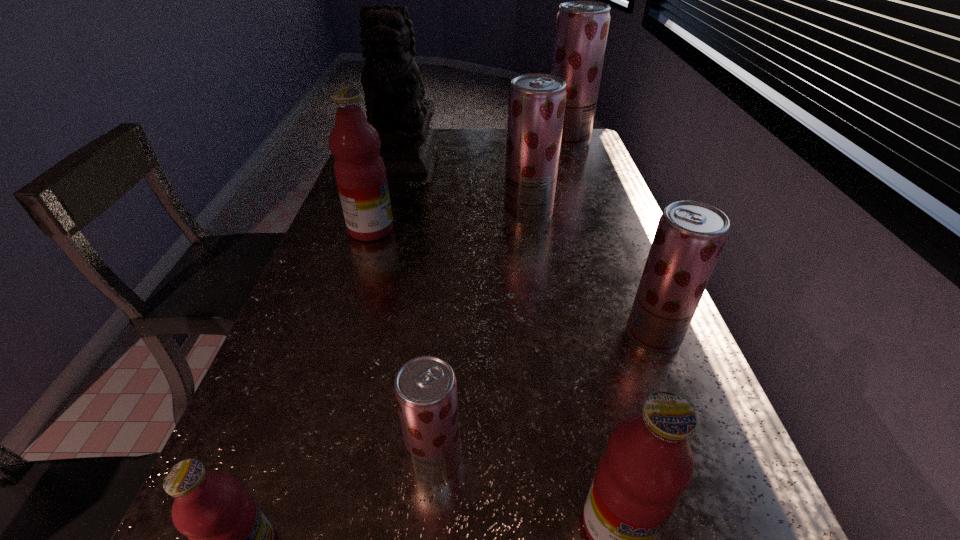
Select which object appears as the fourth closest to the third fruit juice from left to right. Please provide its 2D coordinates. Your answer should be formatted as a tuple, i.e. [(x, y)], where the tuple contains the x and y coordinates of a point satisfying the conditions above.

[(360, 173)]

You are a GUI agent. You are given a task and a screenshot of the screen. Output one action in this format:
    pyautogui.click(x=<x>, y=<y>)
    Task: Click on the fourth closest object relative to the third strawberry fruit juice from right to left
    
    Given the screenshot: What is the action you would take?
    pyautogui.click(x=690, y=235)

Identify which fruit juice is located as the nearest to the second farthest strawberry fruit juice. Please provide its 2D coordinates. Your answer should be formatted as a tuple, i.e. [(x, y)], where the tuple contains the x and y coordinates of a point satisfying the conditions above.

[(360, 173)]

Where is `fruit juice that stands as the sixth closest to the fourth nearest fruit juice`? The width and height of the screenshot is (960, 540). fruit juice that stands as the sixth closest to the fourth nearest fruit juice is located at coordinates (582, 27).

The image size is (960, 540). In order to click on strawberry fruit juice that is the fourth closest to the second smallest pink fruit juice in this screenshot , I will do `click(582, 27)`.

You are a GUI agent. You are given a task and a screenshot of the screen. Output one action in this format:
    pyautogui.click(x=<x>, y=<y>)
    Task: Click on the second closest strawberry fruit juice to the second smallest pink fruit juice
    This screenshot has height=540, width=960.
    Given the screenshot: What is the action you would take?
    pyautogui.click(x=690, y=235)

The image size is (960, 540). Find the location of `pink fruit juice that is the closest to the farthest pink fruit juice`. pink fruit juice that is the closest to the farthest pink fruit juice is located at coordinates (230, 539).

Image resolution: width=960 pixels, height=540 pixels. Identify the location of pink fruit juice object that ranks as the third closest to the farthest fruit juice. (230, 539).

Where is `free point that satisfies the following two spatial constraints: 1. on the front-facing side of the sculpture; 2. on the right side of the third farthest strawberry fruit juice`? The image size is (960, 540). free point that satisfies the following two spatial constraints: 1. on the front-facing side of the sculpture; 2. on the right side of the third farthest strawberry fruit juice is located at coordinates (353, 335).

Where is `vacant position in the image that satisfies the following two spatial constraints: 1. on the front-facing side of the third nearest strawberry fruit juice; 2. on the left side of the sculpture`? The height and width of the screenshot is (540, 960). vacant position in the image that satisfies the following two spatial constraints: 1. on the front-facing side of the third nearest strawberry fruit juice; 2. on the left side of the sculpture is located at coordinates (388, 214).